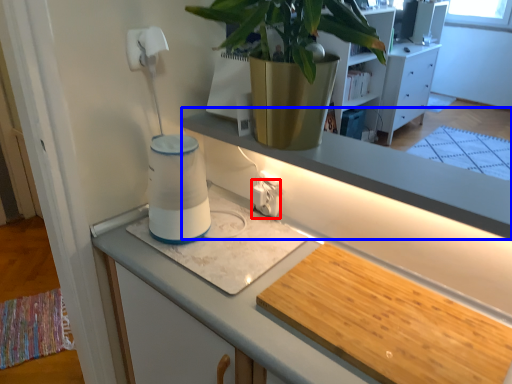
Question: Which object appears closest to the camera in this image, electric outlet (highlighted by a red box) or window sill (highlighted by a blue box)?

Choices:
 (A) electric outlet
 (B) window sill

Answer: (B)